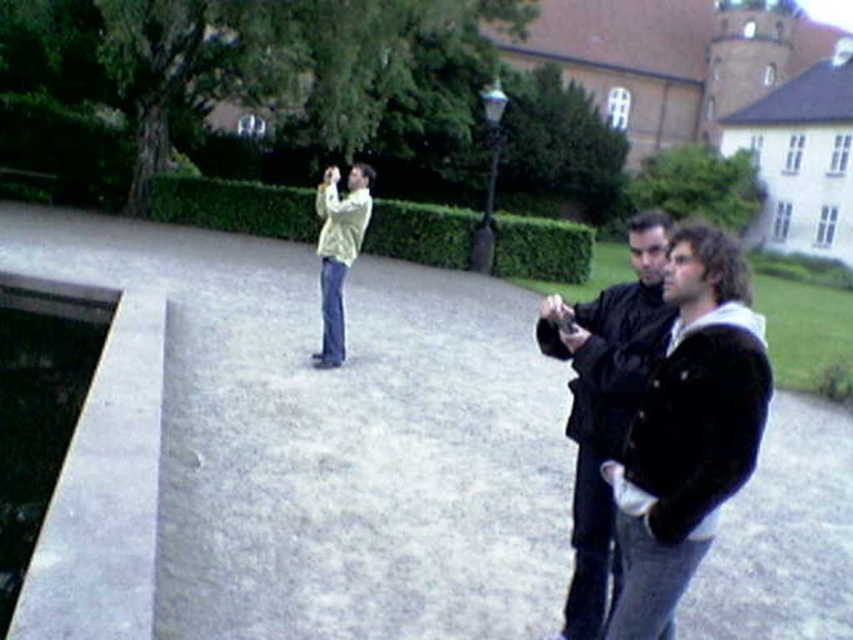
Question: Which of the following is the closest to the observer?

Choices:
 (A) (364, 163)
 (B) (680, 548)
 (C) (674, 204)

Answer: (B)

Question: Does green leafy hedge at upper center have a smaller size compared to light yellow sweater at center?

Choices:
 (A) no
 (B) yes

Answer: (A)

Question: Which point is closer to the camera?

Choices:
 (A) green leafy hedge at upper center
 (B) black velvet jacket at center
 (C) green leafy hedge at center
 (D) light yellow sweater at center

Answer: (B)

Question: Which object is farther from the camera taking this photo?

Choices:
 (A) green leafy hedge at center
 (B) black velvet jacket at center
 (C) green leafy hedge at upper center

Answer: (C)

Question: Where is green leafy hedge at center located in relation to light yellow sweater at center in the image?

Choices:
 (A) left
 (B) right

Answer: (B)

Question: Observing the image, what is the correct spatial positioning of black velvet jacket at center in reference to green leafy hedge at center?

Choices:
 (A) right
 (B) left

Answer: (A)